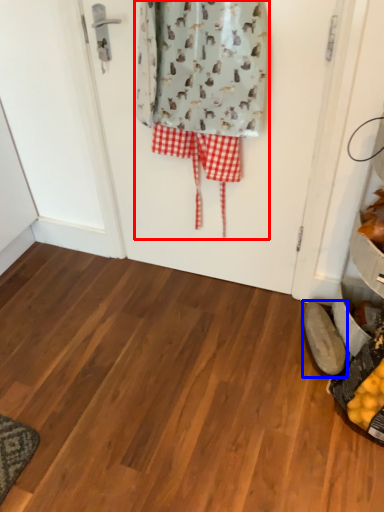
Question: Which object appears farthest to the camera in this image, laundry (highlighted by a red box) or footwear (highlighted by a blue box)?

Choices:
 (A) laundry
 (B) footwear

Answer: (B)